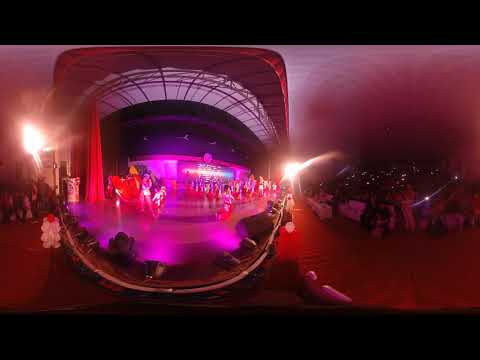
Identify the location of spotlight. The image size is (480, 360). (34, 142), (292, 169).